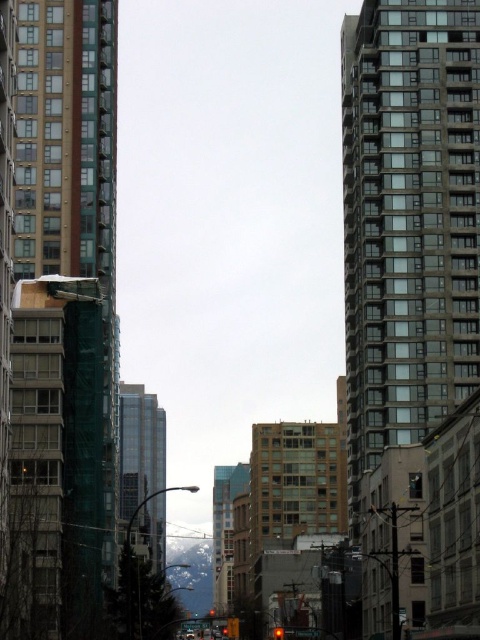
You are standing on the street looking up at the buildings. Which building is positioned further to the east, the green glass building at left or the gray concrete building at center?

The green glass building at left is positioned to the left of the gray concrete building at center, so it is further to the east.

You are standing on the street between the green glass building at left and the glassy reflective building at center. You want to walk to the nearest building. Which one should you walk towards?

The green glass building at left is 187.23 feet away from the glassy reflective building at center. Since you are standing between them, you should walk towards whichever is closer. However, the distance between them is fixed, so you need to know your exact position. If you are closer to the green glass building at left, go there. If closer to the glassy reflective building at center, go there. Without knowing your exact spot, it can not be determined.